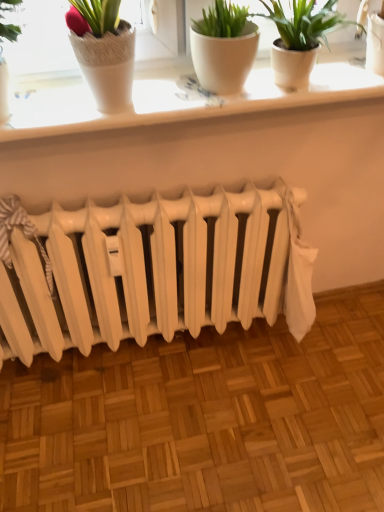
What are the coordinates of `empty space that is to the right of white matte flowerpot at upper center` in the screenshot? It's located at (297, 83).